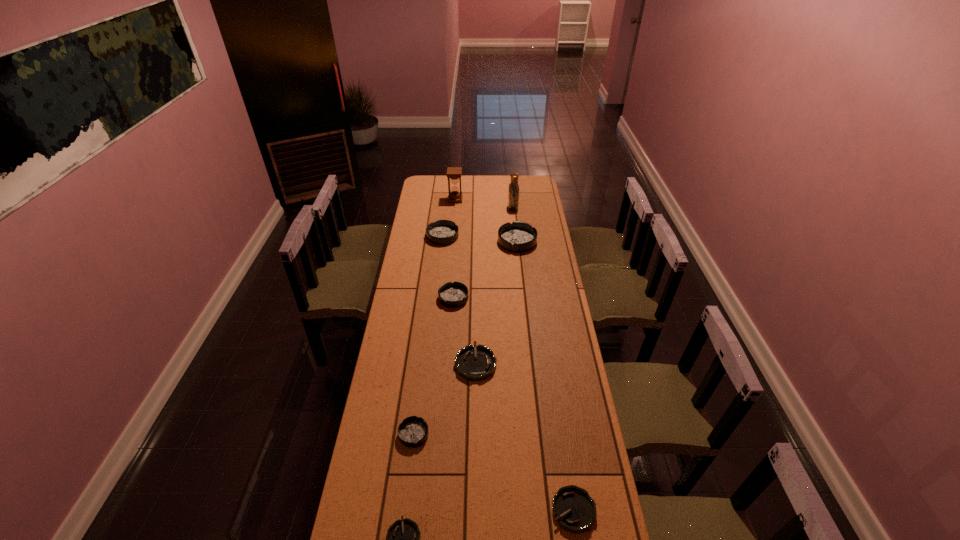
Identify the location of vacant area between the third smallest dark ashtray and the third farthest dark ashtray. The height and width of the screenshot is (540, 960). (448, 267).

Where is `empty space between the biggest dark ashtray and the sixth shortest object`? The width and height of the screenshot is (960, 540). empty space between the biggest dark ashtray and the sixth shortest object is located at coordinates (480, 239).

Image resolution: width=960 pixels, height=540 pixels. Identify the location of empty location between the second smallest dark ashtray and the vodka. (483, 253).

Where is `free space between the sixth shortest ashtray and the third farthest ashtray`? Image resolution: width=960 pixels, height=540 pixels. free space between the sixth shortest ashtray and the third farthest ashtray is located at coordinates (448, 267).

This screenshot has width=960, height=540. Find the location of `the third closest object to the smallest dark ashtray`. the third closest object to the smallest dark ashtray is located at coordinates (574, 510).

You are a GUI agent. You are given a task and a screenshot of the screen. Output one action in this format:
    pyautogui.click(x=<x>, y=<y>)
    Task: Click on the object that ranks as the third closest to the fourth nearest object
    The height and width of the screenshot is (540, 960).
    Given the screenshot: What is the action you would take?
    pyautogui.click(x=574, y=510)

Identify which ashtray is the third nearest to the rightmost green ashtray. Please provide its 2D coordinates. Your answer should be formatted as a tuple, i.e. [(x, y)], where the tuple contains the x and y coordinates of a point satisfying the conditions above.

[(474, 363)]

Select which ashtray appears as the second closest to the second biggest dark ashtray. Please provide its 2D coordinates. Your answer should be formatted as a tuple, i.e. [(x, y)], where the tuple contains the x and y coordinates of a point satisfying the conditions above.

[(452, 295)]

Point out which dark ashtray is positioned as the second nearest to the smallest green ashtray. Please provide its 2D coordinates. Your answer should be formatted as a tuple, i.e. [(x, y)], where the tuple contains the x and y coordinates of a point satisfying the conditions above.

[(452, 295)]

Find the location of a particular element. The image size is (960, 540). dark ashtray that is the fourth closest one to the second green ashtray from left to right is located at coordinates (441, 232).